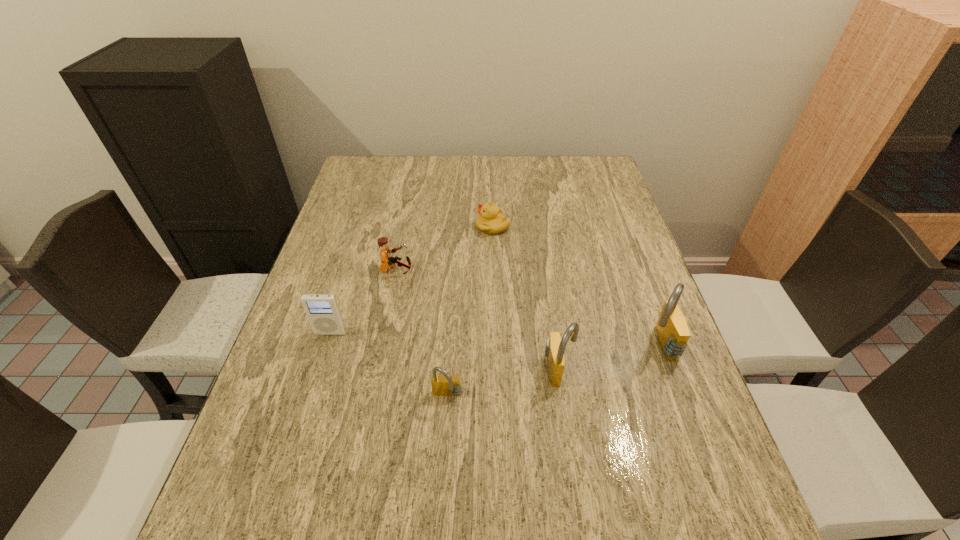
Find the location of a particular element. The width and height of the screenshot is (960, 540). free space for a new padlock on the left is located at coordinates (324, 426).